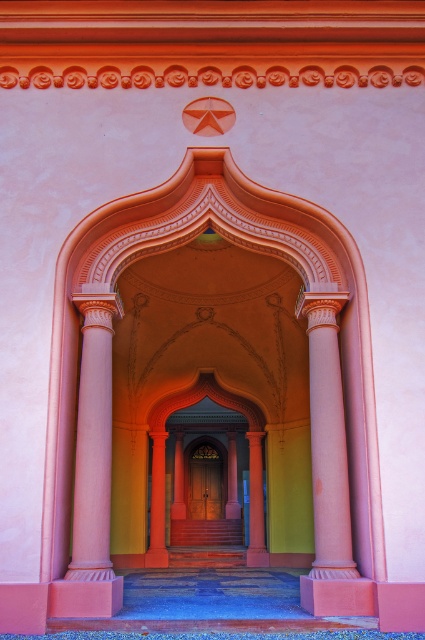
You are standing at the entrance of the building and want to place a decorative statue exactly at the center of the pink polished stone column at center. According to the image, what are the coordinates where you should place the statue?

The coordinates for the pink polished stone column at center are at point (x=328, y=440), so you should place the statue at those coordinates.